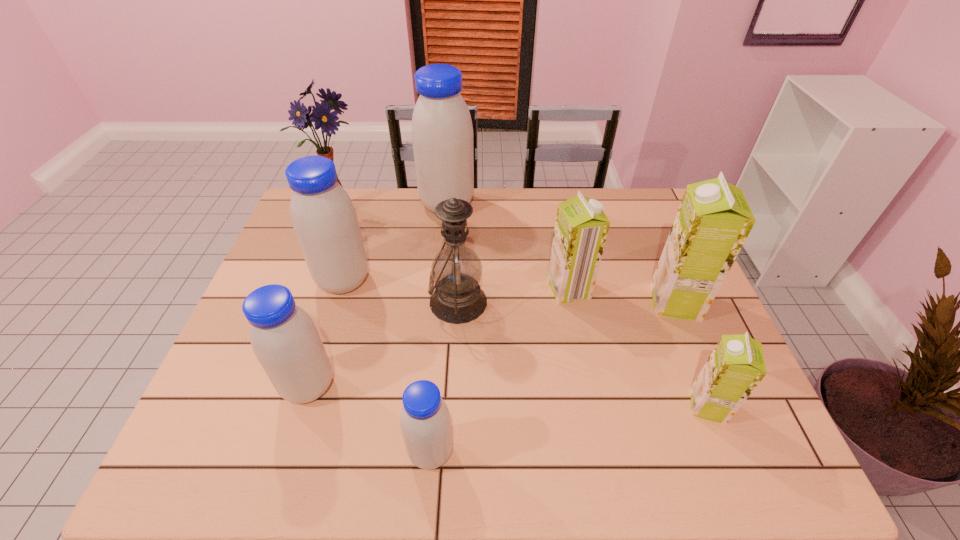
Find the location of a particular element. This screenshot has width=960, height=540. the farthest soya milk is located at coordinates (442, 133).

Image resolution: width=960 pixels, height=540 pixels. I want to click on the farthest blue soya milk, so click(x=442, y=133).

Identify the location of purple flower arrangement. This screenshot has height=540, width=960. (321, 115).

Where is `the biggest green soya milk`? Image resolution: width=960 pixels, height=540 pixels. the biggest green soya milk is located at coordinates (713, 221).

Image resolution: width=960 pixels, height=540 pixels. In order to click on the third nearest blue soya milk in this screenshot , I will do `click(324, 219)`.

The height and width of the screenshot is (540, 960). Identify the location of gray oil lamp. (456, 270).

Locate an element on the screen. Image resolution: width=960 pixels, height=540 pixels. the third biggest blue soya milk is located at coordinates (285, 340).

Find the location of a particular element. The height and width of the screenshot is (540, 960). the second smallest green soya milk is located at coordinates (581, 227).

Where is `the third soya milk from right to left`? This screenshot has height=540, width=960. the third soya milk from right to left is located at coordinates (581, 227).

The width and height of the screenshot is (960, 540). In order to click on the smallest green soya milk in this screenshot , I will do `click(736, 366)`.